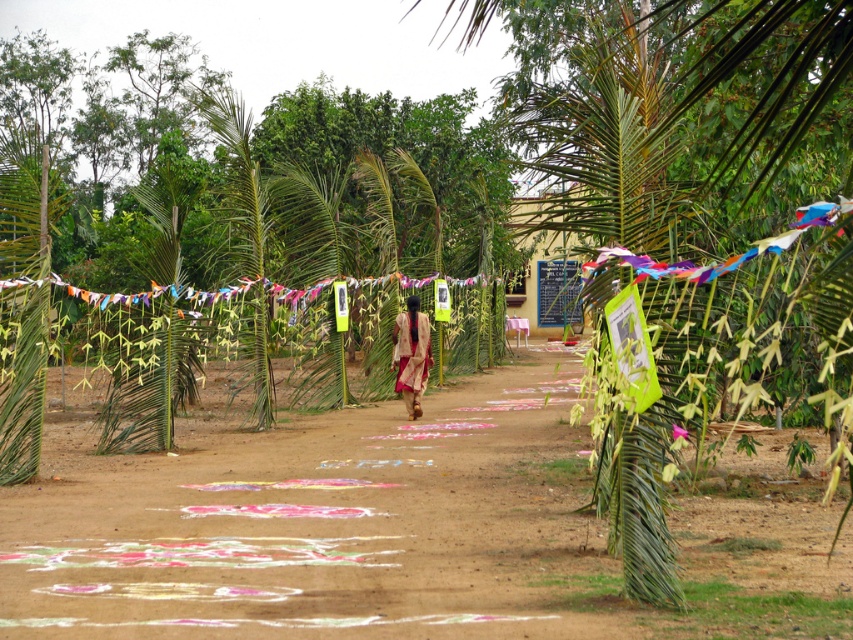
Does colored sand art at center appear over green leafy palm tree at center?

No, colored sand art at center is not above green leafy palm tree at center.

Who is more distant from viewer, [21,589] or [604,292]?

Positioned behind is point [604,292].

Where is `colored sand art at center`? The height and width of the screenshot is (640, 853). colored sand art at center is located at coordinates (320, 525).

Consider the image. Is colored sand art at center to the left of green leafy fence at center from the viewer's perspective?

In fact, colored sand art at center is to the right of green leafy fence at center.

Does colored sand art at center have a lesser width compared to green leafy fence at center?

Yes.

Is point (252, 602) farther from viewer compared to point (488, 360)?

No, it is in front of (488, 360).

Image resolution: width=853 pixels, height=640 pixels. What are the coordinates of `colored sand art at center` in the screenshot? It's located at (320, 525).

Is the position of green leafy fence at center less distant than that of colorful fabric banner at center?

That is True.

Who is more forward, (210, 412) or (422, 284)?

Point (210, 412)

Describe the element at coordinates (467, 330) in the screenshot. I see `green leafy fence at center` at that location.

Find the location of a particular element. green leafy fence at center is located at coordinates tap(467, 330).